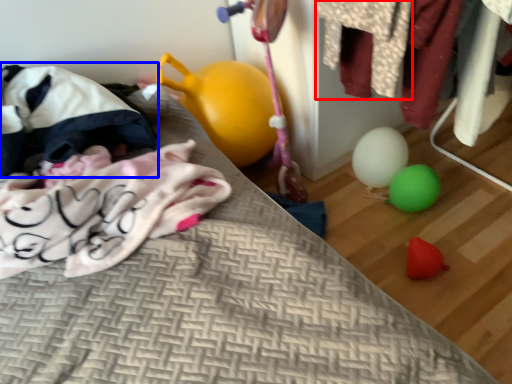
Question: Which object appears farthest to the camera in this image, clothing (highlighted by a red box) or bean bag chair (highlighted by a blue box)?

Choices:
 (A) clothing
 (B) bean bag chair

Answer: (B)